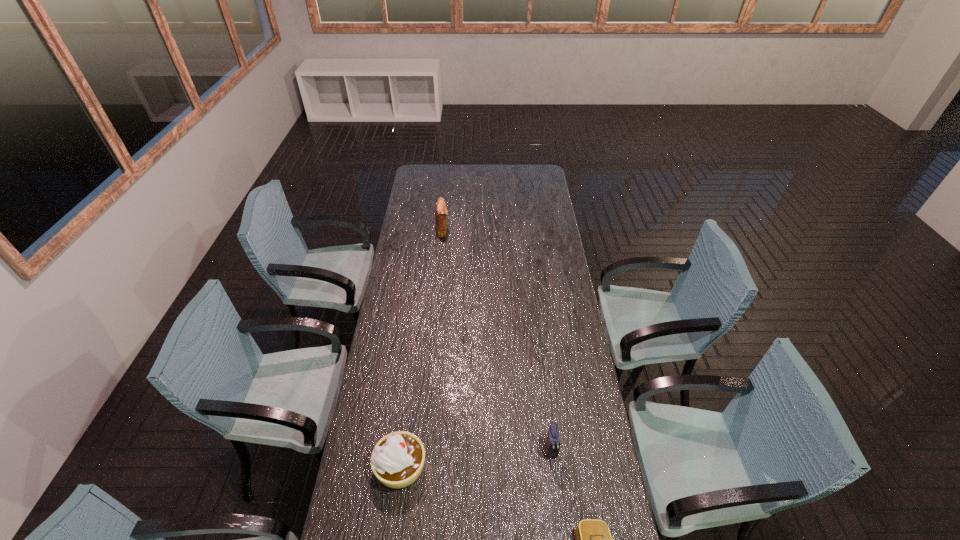
Image resolution: width=960 pixels, height=540 pixels. Identify the location of vacant space at the left edge. (409, 219).

Image resolution: width=960 pixels, height=540 pixels. In the image, there is a desktop. Identify the location of blank space at the right edge. (568, 351).

This screenshot has height=540, width=960. Identify the location of free space at the far left corner of the desktop. (416, 183).

The height and width of the screenshot is (540, 960). In the image, there is a desktop. Identify the location of free space at the far right corner. (525, 182).

The height and width of the screenshot is (540, 960). Find the location of `vacant point located between the second object from right to left and the leftmost clutch bag`. vacant point located between the second object from right to left and the leftmost clutch bag is located at coordinates (496, 340).

What are the coordinates of `free spot between the tallest object and the second farthest clutch bag` in the screenshot? It's located at (496, 340).

I want to click on unoccupied area between the farthest object and the whipped cream, so click(x=421, y=348).

Where is `empty space that is in between the third object from left to right and the farthest clutch bag`? Image resolution: width=960 pixels, height=540 pixels. empty space that is in between the third object from left to right and the farthest clutch bag is located at coordinates (496, 340).

Locate which object is the third closest to the shortest clutch bag. Please provide its 2D coordinates. Your answer should be formatted as a tuple, i.e. [(x, y)], where the tuple contains the x and y coordinates of a point satisfying the conditions above.

[(441, 212)]

I want to click on object that is the third closest to the farthest object, so click(593, 539).